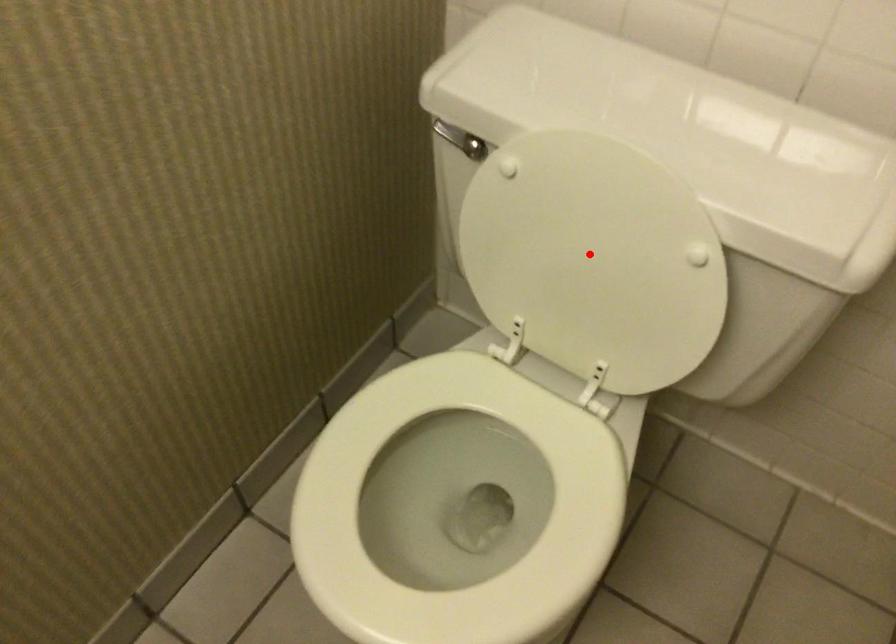
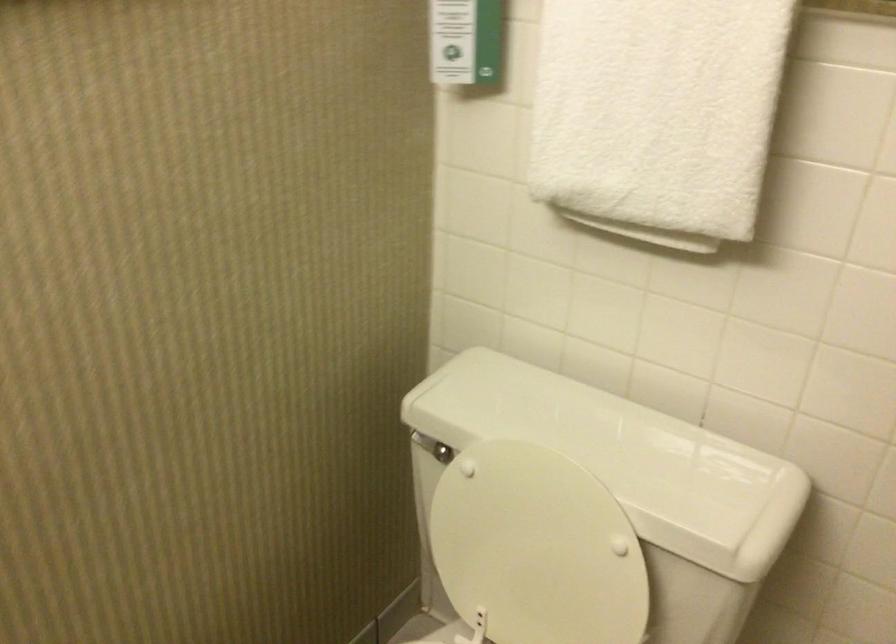
In the second image, find the point that corresponds to the highlighted location in the first image.

(536, 547)